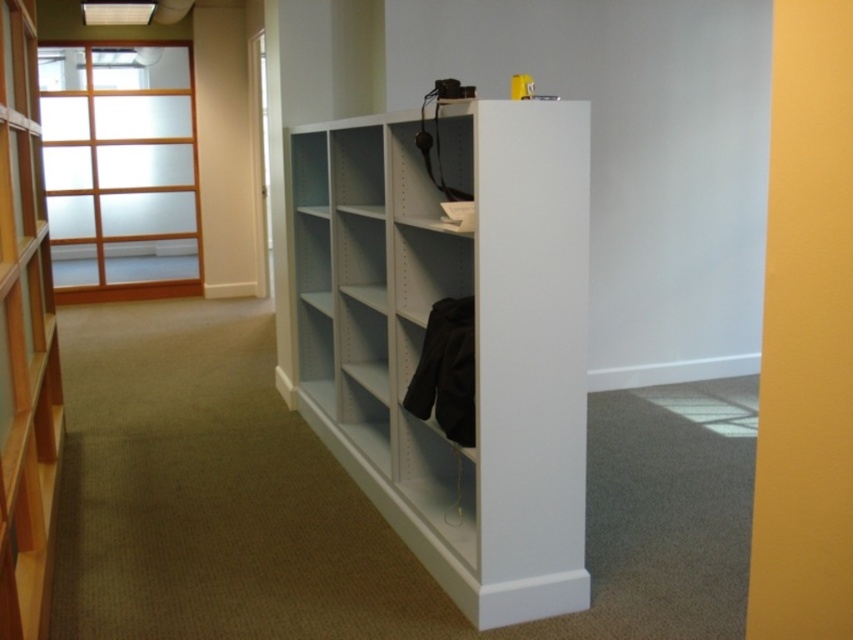
Who is lower down, white matte bookshelf at center or light brown wood bookshelf at left?

white matte bookshelf at center

Can you confirm if white matte bookshelf at center is positioned to the left of light brown wood bookshelf at left?

In fact, white matte bookshelf at center is to the right of light brown wood bookshelf at left.

Is point (326, 444) in front of point (13, 412)?

No, (326, 444) is behind (13, 412).

The height and width of the screenshot is (640, 853). What are the coordinates of `white matte bookshelf at center` in the screenshot? It's located at (476, 339).